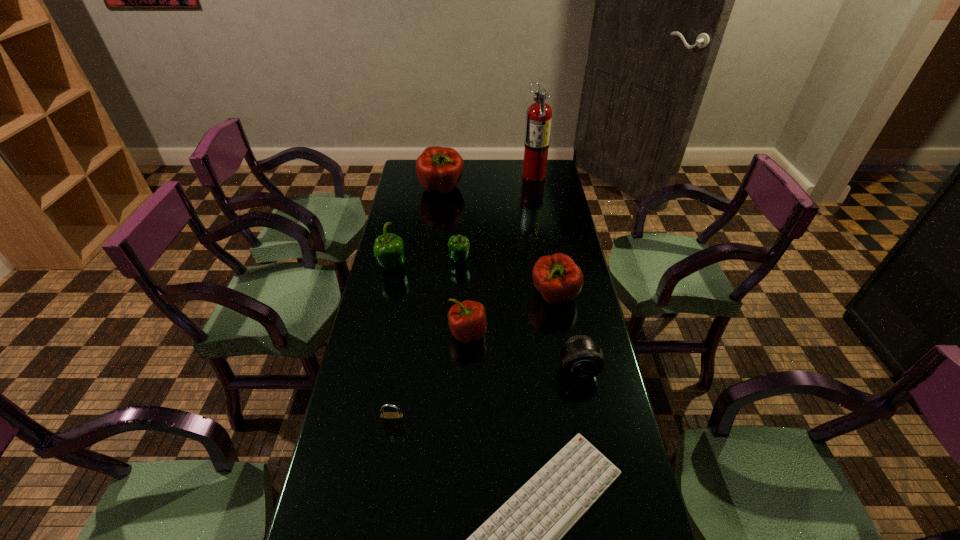
Locate an element on the screen. red fire extinguisher is located at coordinates (539, 114).

Identify the location of fire extinguisher. The image size is (960, 540). (539, 114).

Where is `the farthest pink bell pepper`? The image size is (960, 540). the farthest pink bell pepper is located at coordinates (439, 169).

This screenshot has width=960, height=540. I want to click on the farthest bell pepper, so click(x=439, y=169).

At what (x,y) coordinates should I click in order to perform the action: click on the left green bell pepper. Please return your answer as a coordinate pair (x, y). This screenshot has width=960, height=540. Looking at the image, I should click on pyautogui.click(x=388, y=249).

The height and width of the screenshot is (540, 960). Identify the location of the fifth farthest object. (557, 277).

The height and width of the screenshot is (540, 960). Identify the location of the second nearest pink bell pepper. (557, 277).

Locate an element on the screen. This screenshot has height=540, width=960. the right green bell pepper is located at coordinates (459, 245).

This screenshot has width=960, height=540. In order to click on the nearest bell pepper in this screenshot , I will do `click(467, 320)`.

In order to click on the smallest pink bell pepper in this screenshot , I will do `click(467, 320)`.